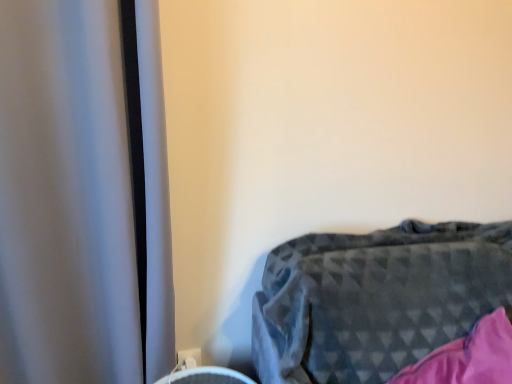
Question: Is white plastic electric outlet at lower center beside dark gray textured blanket at lower right?

Choices:
 (A) no
 (B) yes

Answer: (A)

Question: From a real-world perspective, is white plastic electric outlet at lower center located beneath dark gray textured blanket at lower right?

Choices:
 (A) yes
 (B) no

Answer: (A)

Question: Could you tell me if white plastic electric outlet at lower center is turned towards dark gray textured blanket at lower right?

Choices:
 (A) yes
 (B) no

Answer: (B)

Question: Does white plastic electric outlet at lower center lie behind dark gray textured blanket at lower right?

Choices:
 (A) no
 (B) yes

Answer: (B)

Question: Is white plastic electric outlet at lower center located outside dark gray textured blanket at lower right?

Choices:
 (A) no
 (B) yes

Answer: (B)

Question: Is dark gray textured blanket at lower right completely or partially inside white plastic electric outlet at lower center?

Choices:
 (A) no
 (B) yes

Answer: (A)

Question: Can you confirm if dark gray textured blanket at lower right is smaller than white plastic electric outlet at lower center?

Choices:
 (A) yes
 (B) no

Answer: (B)

Question: Can you see dark gray textured blanket at lower right touching white plastic electric outlet at lower center?

Choices:
 (A) yes
 (B) no

Answer: (B)

Question: Can you confirm if dark gray textured blanket at lower right is positioned to the left of white plastic electric outlet at lower center?

Choices:
 (A) no
 (B) yes

Answer: (A)

Question: Is dark gray textured blanket at lower right at the right side of white plastic electric outlet at lower center?

Choices:
 (A) yes
 (B) no

Answer: (A)

Question: Could you tell me if dark gray textured blanket at lower right is facing white plastic electric outlet at lower center?

Choices:
 (A) yes
 (B) no

Answer: (B)

Question: Is dark gray textured blanket at lower right behind white plastic electric outlet at lower center?

Choices:
 (A) no
 (B) yes

Answer: (A)

Question: Is point (185, 359) closer or farther from the camera than point (476, 261)?

Choices:
 (A) closer
 (B) farther

Answer: (B)